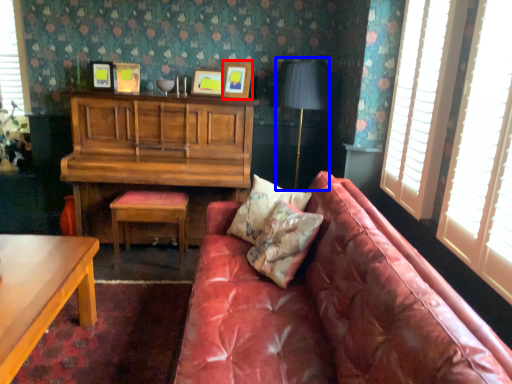
Question: Among these objects, which one is farthest to the camera, picture frame (highlighted by a red box) or table lamp (highlighted by a blue box)?

Choices:
 (A) picture frame
 (B) table lamp

Answer: (A)